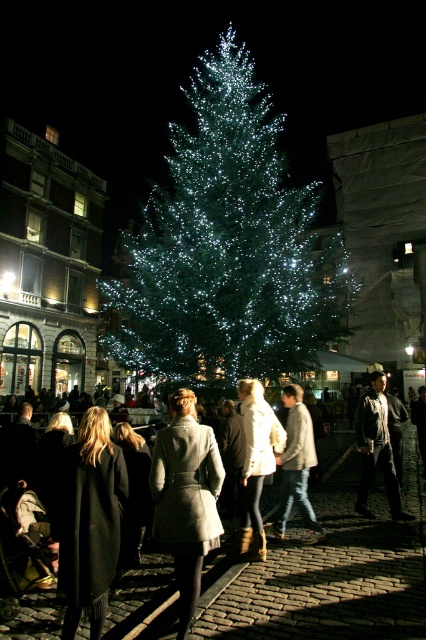
Question: Which of these objects is positioned closest to the light gray wool coat at center?

Choices:
 (A) gray wool coat at center
 (B) illuminated green pine at center
 (C) light brown leather jacket at center

Answer: (A)

Question: Estimate the real-world distances between objects in this image. Which object is farther from the illuminated green pine at center?

Choices:
 (A) leather jacket at center
 (B) light gray wool coat at center

Answer: (B)

Question: Considering the relative positions of black wool coat at center and light brown leather jacket at center in the image provided, where is black wool coat at center located with respect to light brown leather jacket at center?

Choices:
 (A) above
 (B) below

Answer: (B)

Question: Considering the relative positions of white wool coat at center and light brown leather jacket at center in the image provided, where is white wool coat at center located with respect to light brown leather jacket at center?

Choices:
 (A) below
 (B) above

Answer: (B)

Question: Can you confirm if illuminated green pine at center is thinner than black wool coat at center?

Choices:
 (A) no
 (B) yes

Answer: (A)

Question: Estimate the real-world distances between objects in this image. Which object is closer to the illuminated green pine at center?

Choices:
 (A) leather jacket at center
 (B) black wool coat at center

Answer: (A)